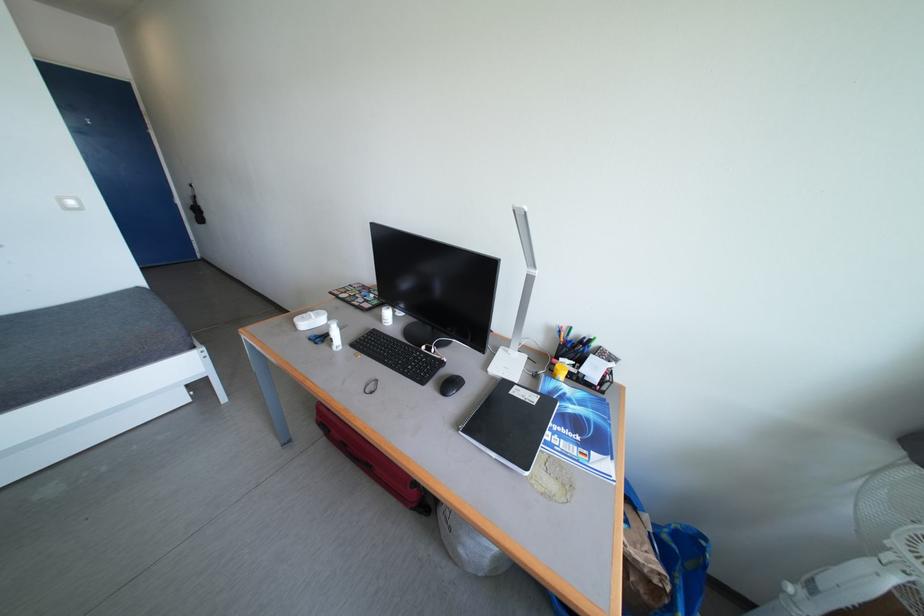
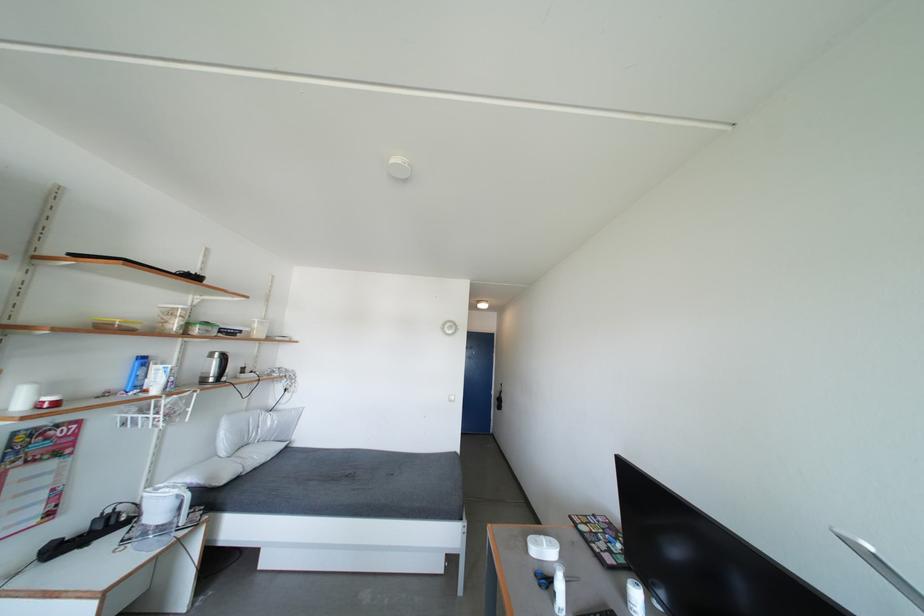
In the second image, find the point that corresponds to point (329, 342) in the first image.

(553, 588)